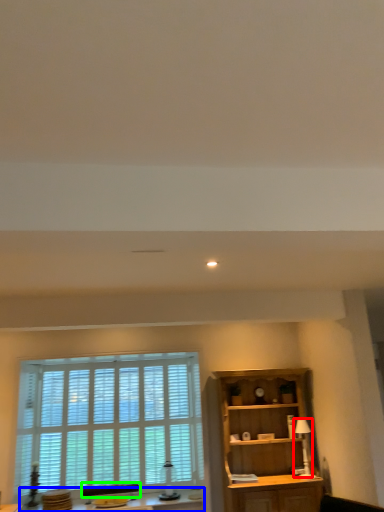
Question: Which object is positioned farthest from lamp (highlighted by a red box)? Select from table (highlighted by a blue box) and swivel chair (highlighted by a green box).

Choices:
 (A) table
 (B) swivel chair

Answer: (B)